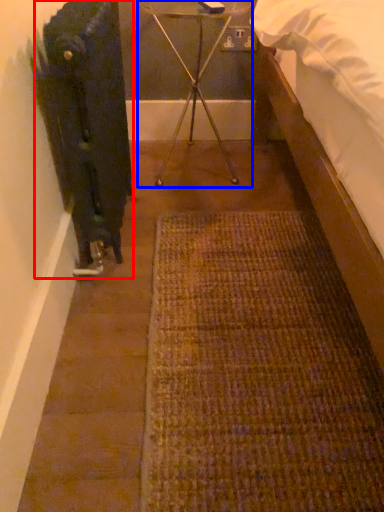
Question: Which of the following is the closest to the observer, radiator (highlighted by a red box) or tripod (highlighted by a blue box)?

Choices:
 (A) radiator
 (B) tripod

Answer: (A)